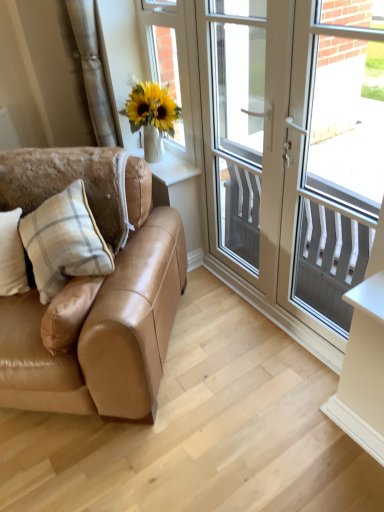
Question: Should I look upward or downward to see white plastic door at center?

Choices:
 (A) down
 (B) up

Answer: (B)

Question: Does white glossy screen door at upper right come behind beige fabric curtain at upper left?

Choices:
 (A) no
 (B) yes

Answer: (A)

Question: Is white glossy screen door at upper right next to beige fabric curtain at upper left and touching it?

Choices:
 (A) yes
 (B) no

Answer: (B)

Question: From the image's perspective, is white glossy screen door at upper right located beneath beige fabric curtain at upper left?

Choices:
 (A) no
 (B) yes

Answer: (B)

Question: From a real-world perspective, is white glossy screen door at upper right over beige fabric curtain at upper left?

Choices:
 (A) no
 (B) yes

Answer: (A)

Question: Is white glossy screen door at upper right oriented towards beige fabric curtain at upper left?

Choices:
 (A) yes
 (B) no

Answer: (B)

Question: Considering the relative sizes of white glossy screen door at upper right and beige fabric curtain at upper left in the image provided, is white glossy screen door at upper right bigger than beige fabric curtain at upper left?

Choices:
 (A) yes
 (B) no

Answer: (A)

Question: Considering the relative sizes of white textured screen at right, the first window screen when ordered from right to left, and white plaid pillow at left, placed as the 1th pillow when sorted from left to right, in the image provided, is white textured screen at right, the first window screen when ordered from right to left, bigger than white plaid pillow at left, placed as the 1th pillow when sorted from left to right,?

Choices:
 (A) yes
 (B) no

Answer: (A)

Question: Considering the relative sizes of white textured screen at right, arranged as the 2th window screen when viewed from the left, and white plaid pillow at left, the second pillow when ordered from right to left, in the image provided, is white textured screen at right, arranged as the 2th window screen when viewed from the left, shorter than white plaid pillow at left, the second pillow when ordered from right to left,?

Choices:
 (A) yes
 (B) no

Answer: (B)

Question: Is white textured screen at right, the first window screen when ordered from right to left, surrounding white plaid pillow at left, the second pillow when ordered from right to left?

Choices:
 (A) no
 (B) yes

Answer: (A)

Question: From a real-world perspective, is white textured screen at right, the first window screen when ordered from right to left, over white plaid pillow at left, placed as the 1th pillow when sorted from left to right?

Choices:
 (A) yes
 (B) no

Answer: (A)

Question: Is white textured screen at right, arranged as the 2th window screen when viewed from the left, at the right side of white plaid pillow at left, placed as the 1th pillow when sorted from left to right?

Choices:
 (A) yes
 (B) no

Answer: (A)

Question: Is white textured screen at right, arranged as the 2th window screen when viewed from the left, turned away from white plaid pillow at left, placed as the 1th pillow when sorted from left to right?

Choices:
 (A) no
 (B) yes

Answer: (A)

Question: Considering the relative sizes of white plaid pillow at left, the second pillow when ordered from right to left, and beige plaid pillow at left, the second pillow from the left, in the image provided, is white plaid pillow at left, the second pillow when ordered from right to left, thinner than beige plaid pillow at left, the second pillow from the left,?

Choices:
 (A) yes
 (B) no

Answer: (B)